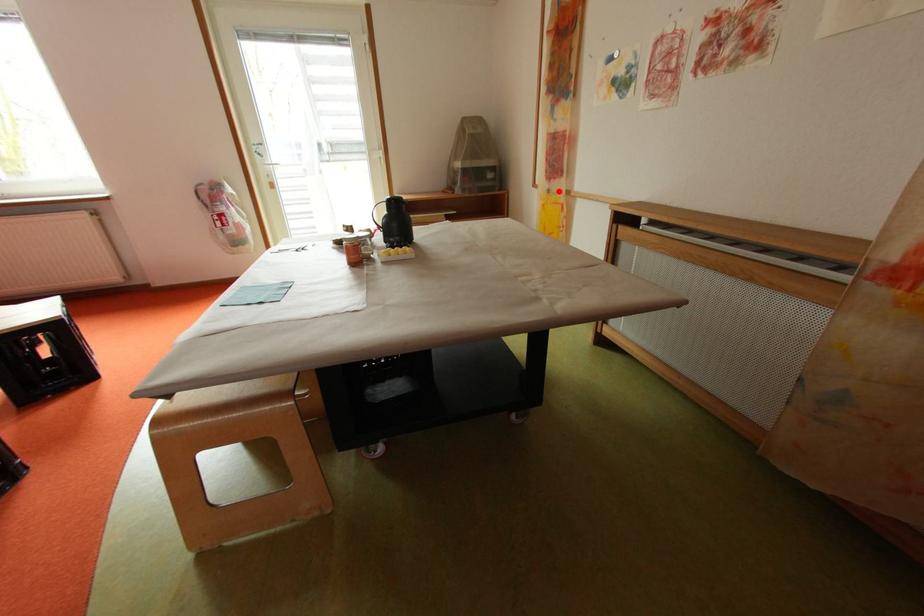
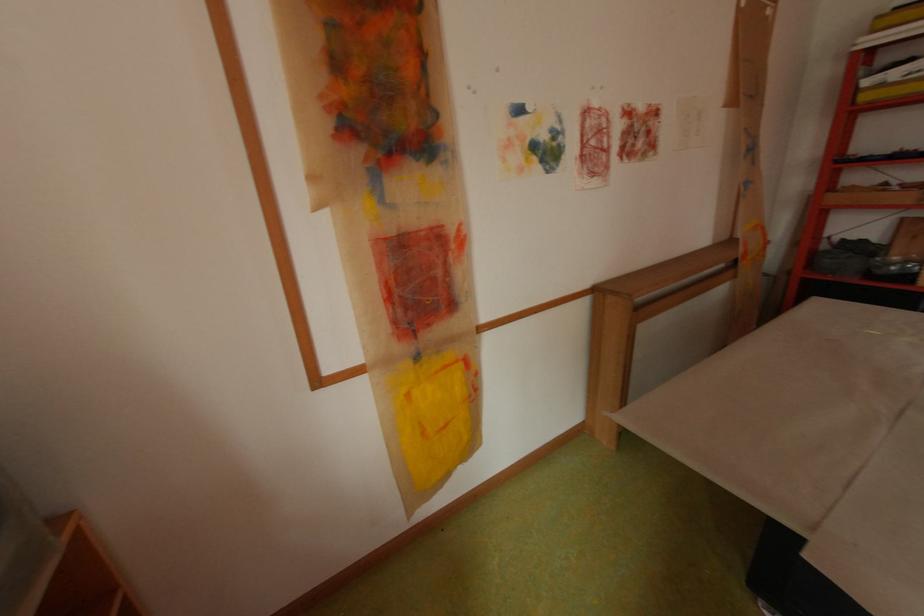
Question: I am providing you with two images of the same scene from different viewpoints. A red point is shown in image1. For the corresponding object point in image2, is it positioned nearer or farther from the camera?

Choices:
 (A) Nearer
 (B) Farther

Answer: (B)